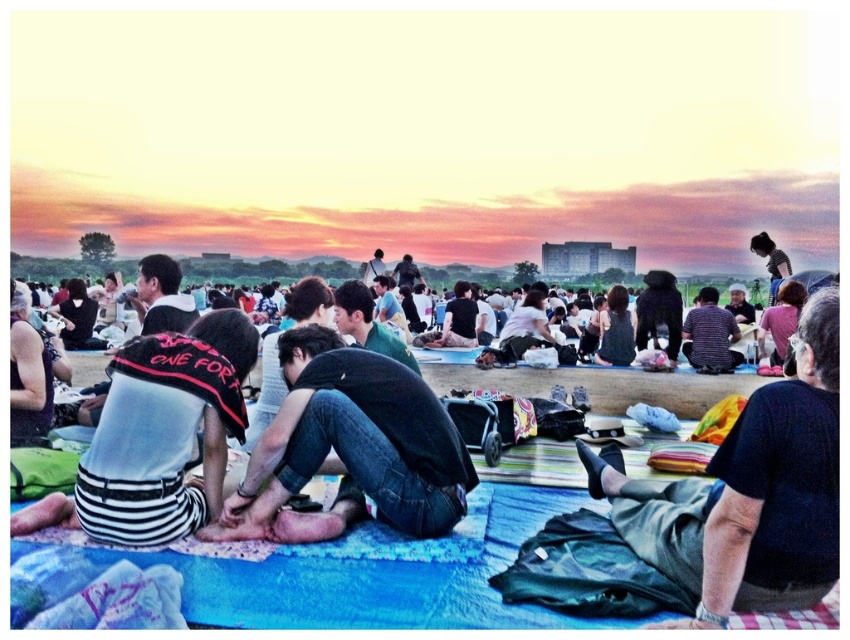
The width and height of the screenshot is (850, 640). What are the coordinates of `denim jeans at center` in the screenshot? It's located at (349, 448).

Is point (384, 358) less distant than point (106, 488)?

No, (384, 358) is behind (106, 488).

You are a GUI agent. You are given a task and a screenshot of the screen. Output one action in this format:
    pyautogui.click(x=<x>, y=<y>)
    Task: Click on the denim jeans at center
    
    Given the screenshot: What is the action you would take?
    tap(349, 448)

Between dark gray pants at center and black striped shirt at center, which one is positioned lower?

Positioned lower is dark gray pants at center.

Is dark gray pants at center closer to camera compared to black striped shirt at center?

Yes, it is.

Which is behind, point (766, 525) or point (204, 362)?

Point (204, 362)

At what (x,y) coordinates should I click in order to perform the action: click on dark gray pants at center. Please return your answer as a coordinate pair (x, y). Looking at the image, I should click on (749, 493).

Is dark gray pants at center bigger than denim jeans at center?

Correct, dark gray pants at center is larger in size than denim jeans at center.

Who is positioned more to the left, dark gray pants at center or denim jeans at center?

denim jeans at center

Who is more distant from viewer, (837, 310) or (256, 456)?

Positioned behind is point (256, 456).

Locate an element on the screen. The width and height of the screenshot is (850, 640). dark gray pants at center is located at coordinates (749, 493).